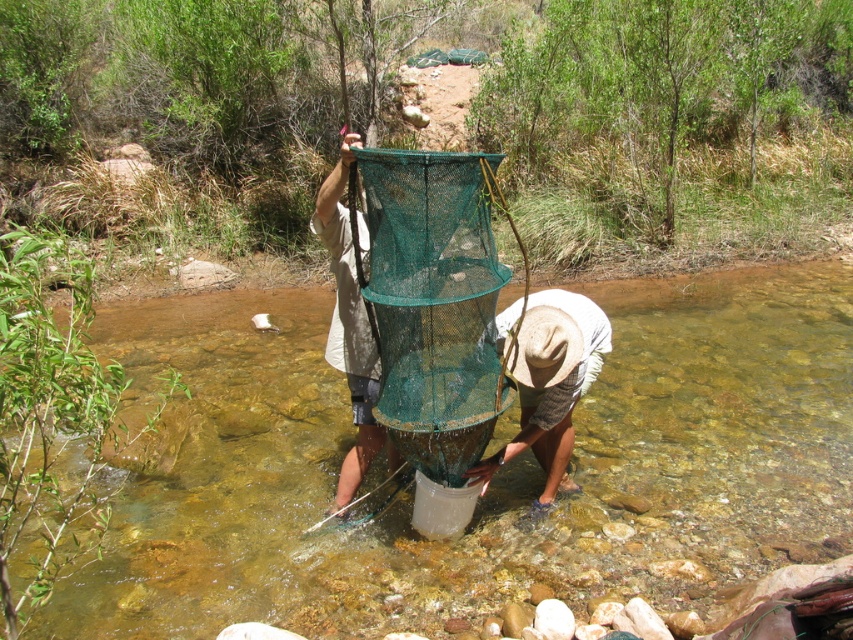
You are planning to take a photo of the clear water at center and the light brown straw hat at lower center. Which object should you focus on first if you want to capture both in a single frame without moving the camera? Explain your reasoning based on their sizes.

The clear water at center is smaller than the light brown straw hat at lower center. To capture both in a single frame without moving the camera, focus on the larger object first, which is the light brown straw hat at lower center, as it occupies more space and will be easier to frame properly.